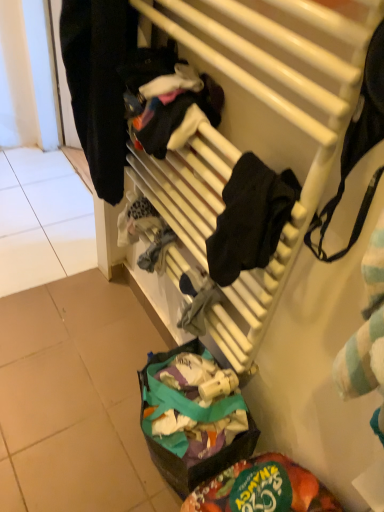
Question: Does white matte radiator at upper center contain green fabric bag at lower center?

Choices:
 (A) no
 (B) yes

Answer: (A)

Question: Is white matte radiator at upper center further to the viewer compared to green fabric bag at lower center?

Choices:
 (A) yes
 (B) no

Answer: (B)

Question: Considering the relative sizes of white matte radiator at upper center and green fabric bag at lower center in the image provided, is white matte radiator at upper center bigger than green fabric bag at lower center?

Choices:
 (A) no
 (B) yes

Answer: (A)

Question: Does white matte radiator at upper center have a greater width compared to green fabric bag at lower center?

Choices:
 (A) no
 (B) yes

Answer: (A)

Question: Is white matte radiator at upper center at the right side of green fabric bag at lower center?

Choices:
 (A) yes
 (B) no

Answer: (B)

Question: From the image's perspective, is white matte radiator at upper center positioned above or below green fabric bag at lower center?

Choices:
 (A) above
 (B) below

Answer: (A)

Question: Is white matte radiator at upper center inside the boundaries of green fabric bag at lower center, or outside?

Choices:
 (A) inside
 (B) outside

Answer: (B)

Question: From a real-world perspective, is white matte radiator at upper center positioned above or below green fabric bag at lower center?

Choices:
 (A) below
 (B) above

Answer: (B)

Question: Is point (337, 73) closer or farther from the camera than point (163, 361)?

Choices:
 (A) farther
 (B) closer

Answer: (B)

Question: Considering their positions, is black matte clothing at left located in front of or behind white matte radiator at upper center?

Choices:
 (A) behind
 (B) front

Answer: (A)

Question: Looking at their shapes, would you say black matte clothing at left is wider or thinner than white matte radiator at upper center?

Choices:
 (A) wide
 (B) thin

Answer: (A)

Question: Considering the positions of black matte clothing at left and white matte radiator at upper center in the image, is black matte clothing at left taller or shorter than white matte radiator at upper center?

Choices:
 (A) tall
 (B) short

Answer: (B)

Question: Does point (132, 10) appear closer or farther from the camera than point (221, 52)?

Choices:
 (A) farther
 (B) closer

Answer: (A)

Question: Looking at the image, does green fabric bag at lower center seem bigger or smaller compared to black matte clothing at left?

Choices:
 (A) big
 (B) small

Answer: (B)

Question: Looking at their shapes, would you say green fabric bag at lower center is wider or thinner than black matte clothing at left?

Choices:
 (A) thin
 (B) wide

Answer: (B)